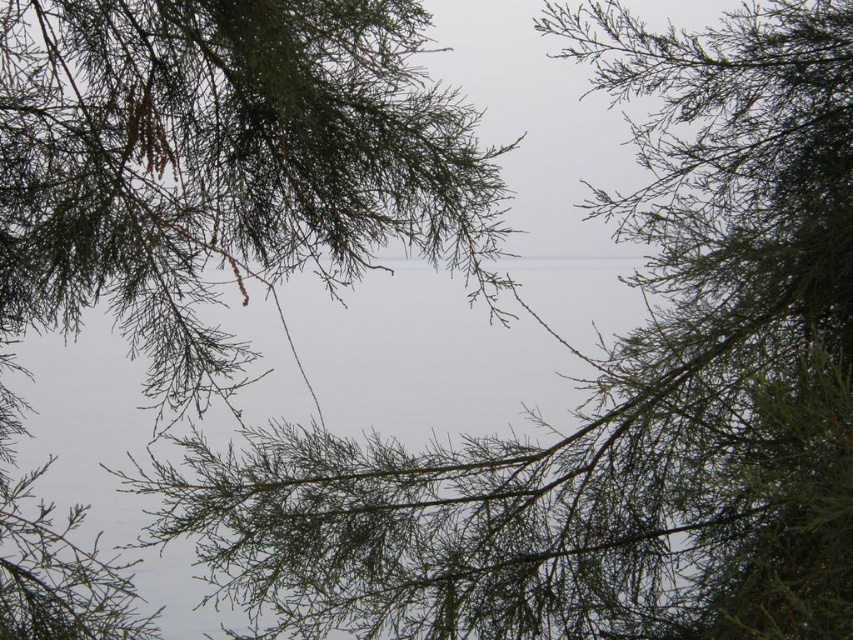
Is green needle-like branches at upper center wider than transparent water at center?

Incorrect, green needle-like branches at upper center's width does not surpass transparent water at center's.

Does point (177, 342) come farther from viewer compared to point (486, 620)?

That is True.

Locate an element on the screen. The height and width of the screenshot is (640, 853). green needle-like branches at upper center is located at coordinates (204, 205).